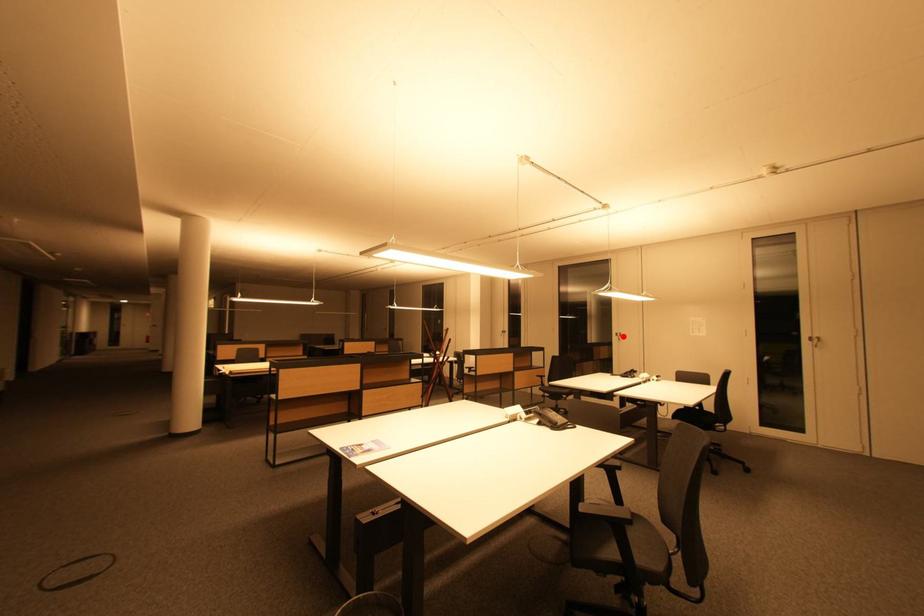
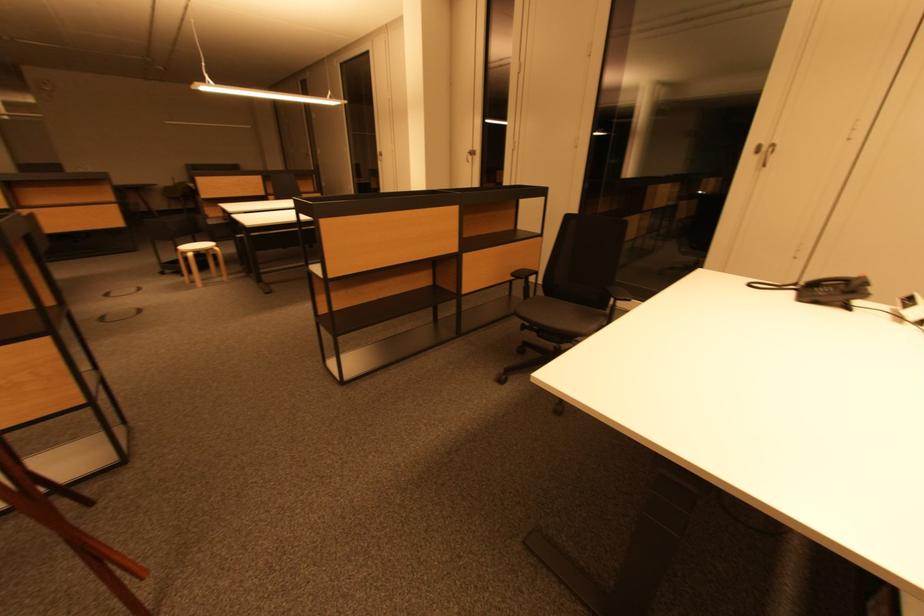
In the second image, find the point that corresponds to the highlighted location in the first image.

(767, 150)